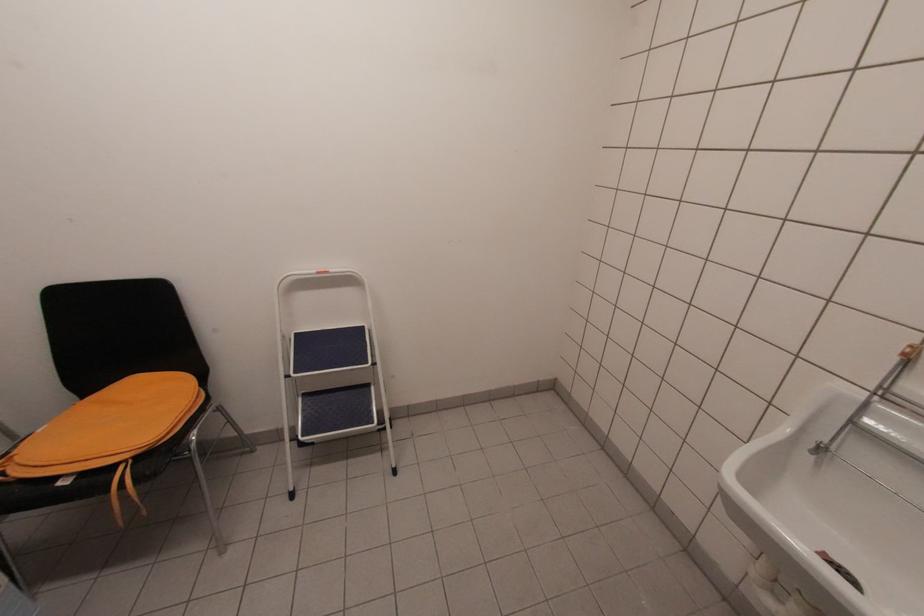
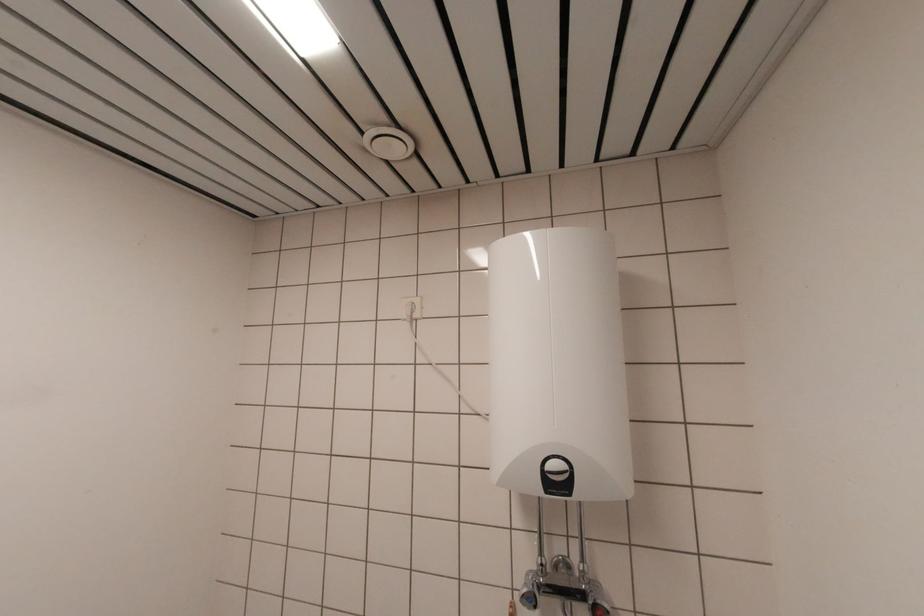
In the scene shown: First-person continuous shooting, in which direction is the camera rotating?

The rotation direction of the camera is right-up.